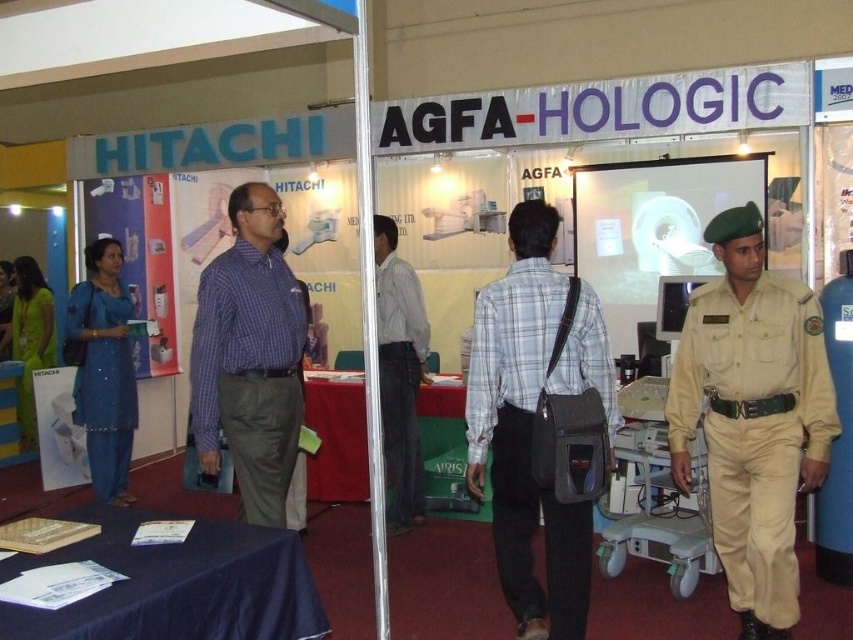
Question: Which object is closer to the camera taking this photo?

Choices:
 (A) blue sequined salwar kameez at left
 (B) gray fabric bag at center

Answer: (B)

Question: Considering the relative positions of blue checkered shirt at center and green fabric uniform at left in the image provided, where is blue checkered shirt at center located with respect to green fabric uniform at left?

Choices:
 (A) right
 (B) left

Answer: (A)

Question: Which point appears farthest from the camera in this image?

Choices:
 (A) (228, 442)
 (B) (606, 376)
 (C) (393, 468)
 (D) (730, 385)

Answer: (C)

Question: Considering the real-world distances, which object is closest to the tan uniform at right?

Choices:
 (A) green fabric uniform at left
 (B) gray fabric bag at center
 (C) blue sequined salwar kameez at left
 (D) dark gray fabric shirt at center

Answer: (B)

Question: Does gray fabric bag at center have a larger size compared to blue checkered shirt at center?

Choices:
 (A) yes
 (B) no

Answer: (A)

Question: Is tan uniform at right thinner than blue sequined salwar kameez at left?

Choices:
 (A) yes
 (B) no

Answer: (B)